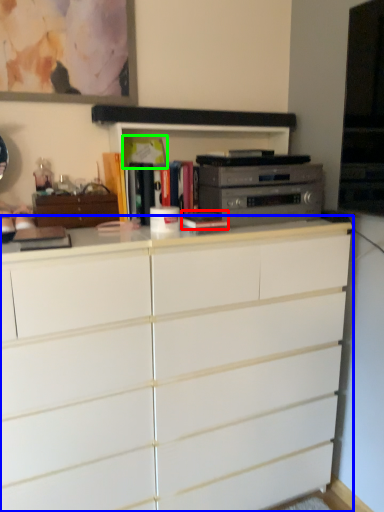
Question: Which object is positioned farthest from book (highlighted by a red box)? Select from chest of drawers (highlighted by a blue box) and book (highlighted by a green box).

Choices:
 (A) chest of drawers
 (B) book

Answer: (A)